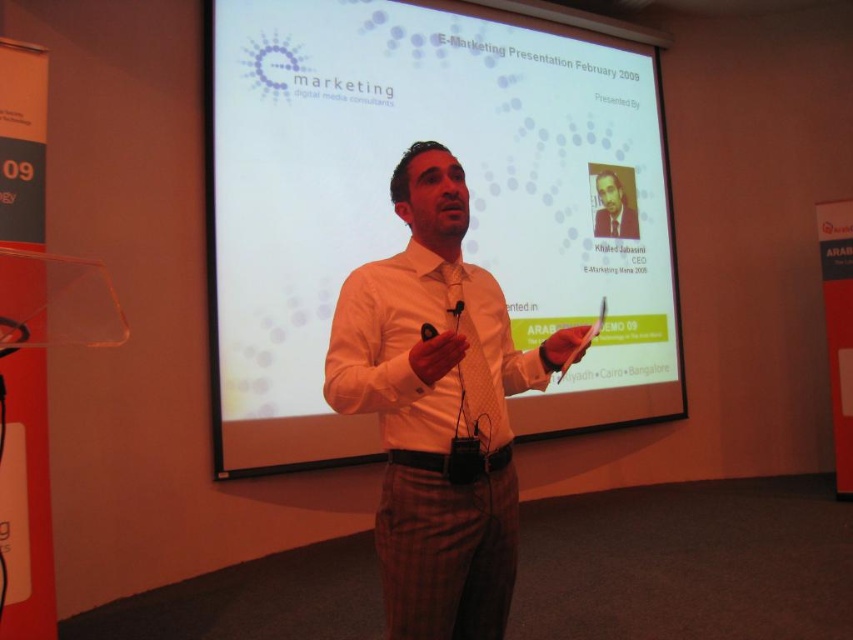
Question: Considering the relative positions of white textured shirt at center and matte white shirt at center in the image provided, where is white textured shirt at center located with respect to matte white shirt at center?

Choices:
 (A) right
 (B) left

Answer: (B)

Question: Is white textured shirt at center to the right of matte white shirt at center from the viewer's perspective?

Choices:
 (A) no
 (B) yes

Answer: (A)

Question: Which object is positioned farthest from the white textured shirt at center?

Choices:
 (A) white matte projection screen at center
 (B) matte white shirt at center

Answer: (B)

Question: From the image, what is the correct spatial relationship of white matte projection screen at center in relation to white textured shirt at center?

Choices:
 (A) right
 (B) left

Answer: (A)

Question: Which point is farther to the camera?

Choices:
 (A) white matte projection screen at center
 (B) white textured shirt at center
 (C) matte white shirt at center

Answer: (C)

Question: Based on their relative distances, which object is farther from the matte white shirt at center?

Choices:
 (A) white textured shirt at center
 (B) white matte projection screen at center

Answer: (A)